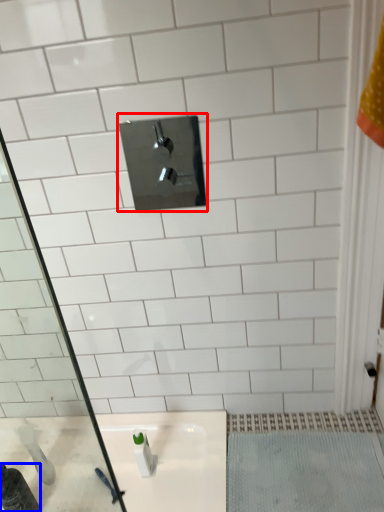
Question: Among these objects, which one is nearest to the camera, tap (highlighted by a red box) or bottle (highlighted by a blue box)?

Choices:
 (A) tap
 (B) bottle

Answer: (A)